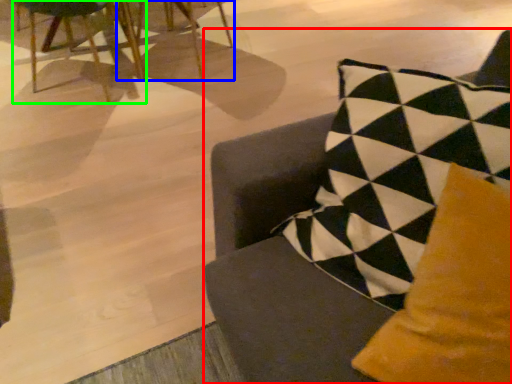
Question: Which is farther away from chair (highlighted by a red box)? chair (highlighted by a blue box) or chair (highlighted by a green box)?

Choices:
 (A) chair
 (B) chair

Answer: (A)